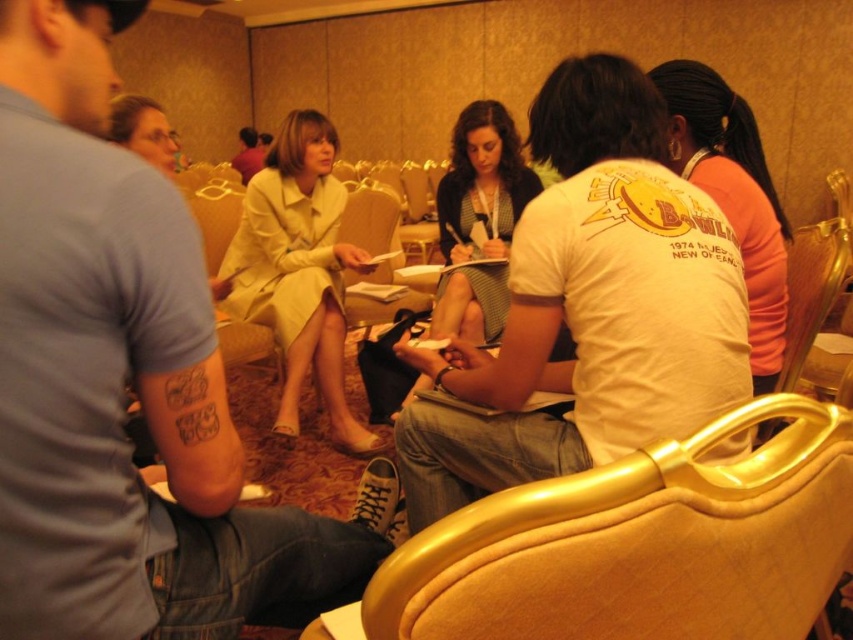
Is white matte shirt at upper right smaller than light beige suit at center?

Indeed, white matte shirt at upper right has a smaller size compared to light beige suit at center.

Between white matte shirt at upper right and light beige suit at center, which one appears on the left side from the viewer's perspective?

light beige suit at center is more to the left.

Which is in front, point (751, 136) or point (247, 166)?

Point (751, 136)

Find the location of `white matte shirt at upper right`. white matte shirt at upper right is located at coordinates (733, 195).

Does matte yellow coat at center appear over white matte shirt at upper right?

Incorrect, matte yellow coat at center is not positioned above white matte shirt at upper right.

Between matte yellow coat at center and white matte shirt at upper right, which one has more height?

matte yellow coat at center is taller.

Does point (276, 324) come closer to viewer compared to point (676, 166)?

No, (276, 324) is further to viewer.

Identify the location of matte yellow coat at center. The height and width of the screenshot is (640, 853). (299, 269).

Who is higher up, denim jeans at center or matte yellow coat at center?

Positioned higher is matte yellow coat at center.

Image resolution: width=853 pixels, height=640 pixels. Describe the element at coordinates (120, 380) in the screenshot. I see `denim jeans at center` at that location.

Image resolution: width=853 pixels, height=640 pixels. In order to click on denim jeans at center in this screenshot , I will do `click(120, 380)`.